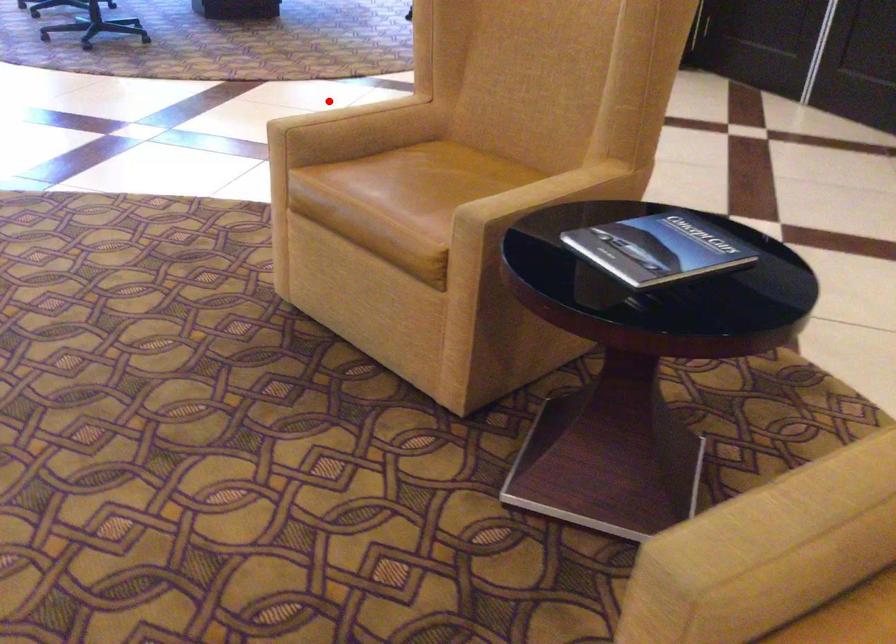
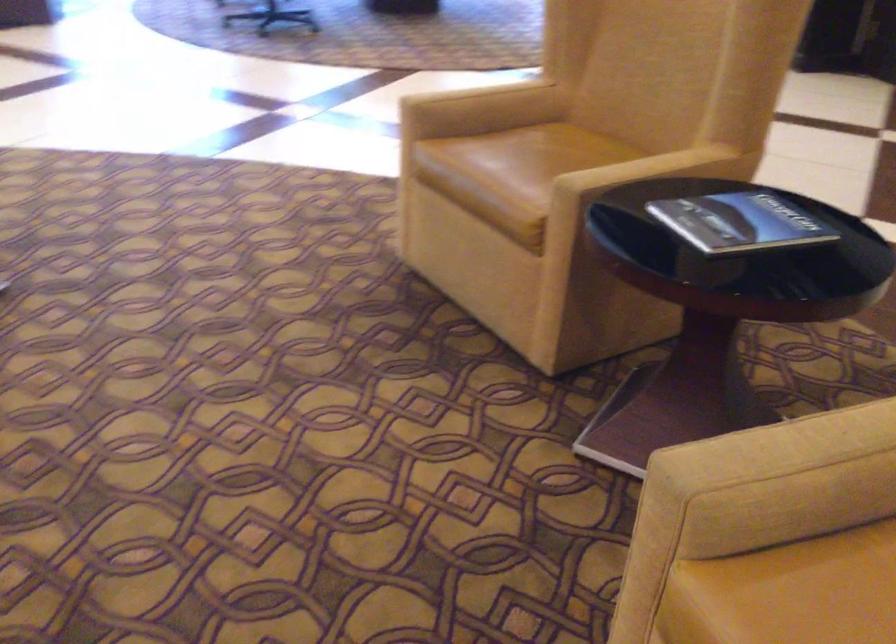
Question: I am providing you with two images of the same scene from different viewpoints. A red point is marked on the first image. Is the red point's position out of view in image 2?

Choices:
 (A) Yes
 (B) No

Answer: (B)